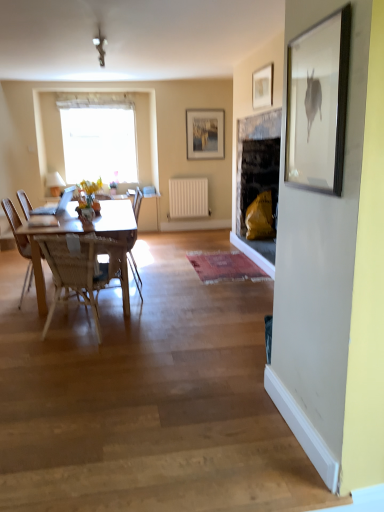
Image resolution: width=384 pixels, height=512 pixels. What do you see at coordinates (262, 86) in the screenshot? I see `matte wooden picture frame at upper center, arranged as the second picture frame when viewed from the left` at bounding box center [262, 86].

Where is `matte glass picture frame at upper center, marked as the first picture frame in a left-to-right arrangement`? matte glass picture frame at upper center, marked as the first picture frame in a left-to-right arrangement is located at coordinates (205, 133).

Measure the distance between wooden table at center and camera.

They are 3.60 meters apart.

Identify the location of white matte radiator at center. (188, 198).

The width and height of the screenshot is (384, 512). What do you see at coordinates (188, 198) in the screenshot?
I see `white matte radiator at center` at bounding box center [188, 198].

You are a GUI agent. You are given a task and a screenshot of the screen. Output one action in this format:
    pyautogui.click(x=<x>, y=<y>)
    Task: Click on the wooden chair at center
    The height and width of the screenshot is (512, 384).
    Given the screenshot: What is the action you would take?
    pyautogui.click(x=137, y=203)

Is matte wooden picture frame at upper center, positioned as the second picture frame in back-to-front order, next to white sheer curtain at upper center and touching it?

No, matte wooden picture frame at upper center, positioned as the second picture frame in back-to-front order, is not beside white sheer curtain at upper center.

From the picture: Does matte wooden picture frame at upper center, positioned as the second picture frame in back-to-front order, turn towards white sheer curtain at upper center?

No, matte wooden picture frame at upper center, positioned as the second picture frame in back-to-front order, is not facing towards white sheer curtain at upper center.

From a real-world perspective, which is physically above, matte wooden picture frame at upper center, positioned as the second picture frame in back-to-front order, or white sheer curtain at upper center?

In real-world perspective, matte wooden picture frame at upper center, positioned as the second picture frame in back-to-front order, is above.

Between matte wooden picture frame at upper center, arranged as the second picture frame when viewed from the left, and wooden chair at center, which one has smaller width?

matte wooden picture frame at upper center, arranged as the second picture frame when viewed from the left.

Considering the sizes of objects matte wooden picture frame at upper center, arranged as the second picture frame when viewed from the left, and wooden chair at center in the image provided, who is taller, matte wooden picture frame at upper center, arranged as the second picture frame when viewed from the left, or wooden chair at center?

With more height is wooden chair at center.

Is the depth of matte wooden picture frame at upper center, positioned as the second picture frame in back-to-front order, less than that of wooden chair at center?

No, matte wooden picture frame at upper center, positioned as the second picture frame in back-to-front order, is behind wooden chair at center.

In the scene shown: Is wooden chair at center smaller than white matte radiator at center?

Actually, wooden chair at center might be larger than white matte radiator at center.

Can you confirm if wooden chair at center is positioned to the right of white matte radiator at center?

No, wooden chair at center is not to the right of white matte radiator at center.

Locate an element on the screen. chair in front of the white matte radiator at center is located at coordinates (137, 203).

From the picture: Considering the relative positions of wooden chair at center and matte glass picture frame at upper center, marked as the first picture frame in a left-to-right arrangement, in the image provided, is wooden chair at center to the left or to the right of matte glass picture frame at upper center, marked as the first picture frame in a left-to-right arrangement,?

Based on their positions, wooden chair at center is located to the left of matte glass picture frame at upper center, marked as the first picture frame in a left-to-right arrangement.

How many degrees apart are the facing directions of wooden chair at center and matte glass picture frame at upper center, the second picture frame from the front?

They differ by 90.6 degrees in their facing directions.

Which of these two, wooden chair at center or matte glass picture frame at upper center, the second picture frame from the front, is smaller?

matte glass picture frame at upper center, the second picture frame from the front.

Where is `chair below the matte glass vase at center (from the image's perspective)`? The height and width of the screenshot is (512, 384). chair below the matte glass vase at center (from the image's perspective) is located at coordinates (137, 203).

From a real-world perspective, between wooden chair at center and matte glass vase at center, who is vertically higher?

In real-world perspective, matte glass vase at center is above.

Could you tell me if wooden chair at center is turned towards matte glass vase at center?

Yes, wooden chair at center is aimed at matte glass vase at center.

Between wooden chair at center and matte glass vase at center, which one has larger size?

Bigger between the two is wooden chair at center.

Considering the sizes of wooden chair at center and white sheer curtain at upper center in the image, is wooden chair at center bigger or smaller than white sheer curtain at upper center?

Considering their sizes, wooden chair at center takes up less space than white sheer curtain at upper center.

From the picture: Is wooden chair at center not inside white sheer curtain at upper center?

Yes, wooden chair at center is not within white sheer curtain at upper center.

Considering the positions of point (134, 198) and point (111, 100), is point (134, 198) closer or farther from the camera than point (111, 100)?

Point (134, 198).

Is point (187, 157) less distant than point (35, 242)?

That is False.

Is matte glass picture frame at upper center, the 2th picture frame when ordered from right to left, oriented towards wooden table at center?

No, matte glass picture frame at upper center, the 2th picture frame when ordered from right to left, does not turn towards wooden table at center.

From the image's perspective, is matte glass picture frame at upper center, the 2th picture frame when ordered from right to left, beneath wooden table at center?

Incorrect, from the image's perspective, matte glass picture frame at upper center, the 2th picture frame when ordered from right to left, is higher than wooden table at center.

Is matte glass picture frame at upper center, marked as the first picture frame in a left-to-right arrangement, spatially inside wooden table at center, or outside of it?

matte glass picture frame at upper center, marked as the first picture frame in a left-to-right arrangement, cannot be found inside wooden table at center.

This screenshot has width=384, height=512. Identify the location of the 2nd picture frame located above the white sheer curtain at upper center (from a real-world perspective). (262, 86).

Where is `chair that appears in front of the matte wooden picture frame at upper center, arranged as the second picture frame when viewed from the left`? chair that appears in front of the matte wooden picture frame at upper center, arranged as the second picture frame when viewed from the left is located at coordinates (137, 203).

Estimate the real-world distances between objects in this image. Which object is closer to wooden chair at center, wooden table at center or white matte radiator at center?

white matte radiator at center is closer to wooden chair at center.

Based on their spatial positions, is white matte radiator at center or matte glass vase at center further from matte wooden picture frame at upper center, which appears as the 1th picture frame when viewed from the front?

white matte radiator at center.

Estimate the real-world distances between objects in this image. Which object is closer to matte wooden picture frame at upper center, which appears as the 1th picture frame when viewed from the front, white sheer curtain at upper center or white matte radiator at center?

white matte radiator at center is closer to matte wooden picture frame at upper center, which appears as the 1th picture frame when viewed from the front.

Based on the photo, when comparing their distances from matte glass picture frame at upper center, marked as the first picture frame in a left-to-right arrangement, does matte wooden picture frame at upper center, positioned as the second picture frame in back-to-front order, or wooden chair at center seem further?

Based on the image, matte wooden picture frame at upper center, positioned as the second picture frame in back-to-front order, appears to be further to matte glass picture frame at upper center, marked as the first picture frame in a left-to-right arrangement.

Estimate the real-world distances between objects in this image. Which object is closer to matte glass vase at center, matte wooden picture frame at upper center, arranged as the second picture frame when viewed from the left, or white matte radiator at center?

white matte radiator at center is positioned closer to the anchor matte glass vase at center.

When comparing their distances from white matte radiator at center, does wooden chair at center or matte wooden picture frame at upper center, which appears as the 1th picture frame when viewed from the front, seem further?

matte wooden picture frame at upper center, which appears as the 1th picture frame when viewed from the front, is further to white matte radiator at center.

Which object lies further to the anchor point matte glass picture frame at upper center, the 2th picture frame when ordered from right to left, white matte radiator at center or matte glass vase at center?

Among the two, matte glass vase at center is located further to matte glass picture frame at upper center, the 2th picture frame when ordered from right to left.

From the picture: Considering their positions, is white sheer curtain at upper center positioned further to white matte radiator at center than wooden table at center?

Among the two, wooden table at center is located further to white matte radiator at center.

At what (x,y) coordinates should I click in order to perform the action: click on picture frame between wooden chair at center and matte glass picture frame at upper center, the 2th picture frame when ordered from right to left, along the z-axis. Please return your answer as a coordinate pair (x, y). This screenshot has height=512, width=384. Looking at the image, I should click on (262, 86).

This screenshot has height=512, width=384. I want to click on vase between wooden chair at center and matte glass picture frame at upper center, the 2th picture frame when ordered from right to left, along the z-axis, so click(86, 214).

I want to click on chair located between wooden table at center and matte glass picture frame at upper center, marked as the first picture frame in a left-to-right arrangement, in the depth direction, so (137, 203).

Find the location of `chair located between wooden table at center and white matte radiator at center in the depth direction`. chair located between wooden table at center and white matte radiator at center in the depth direction is located at coordinates (137, 203).